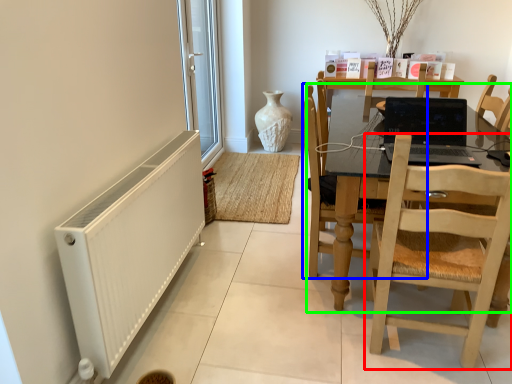
Question: Based on their relative distances, which object is farther from chair (highlighted by a red box)? Choose from chair (highlighted by a blue box) and kitchen & dining room table (highlighted by a green box).

Choices:
 (A) chair
 (B) kitchen & dining room table

Answer: (A)